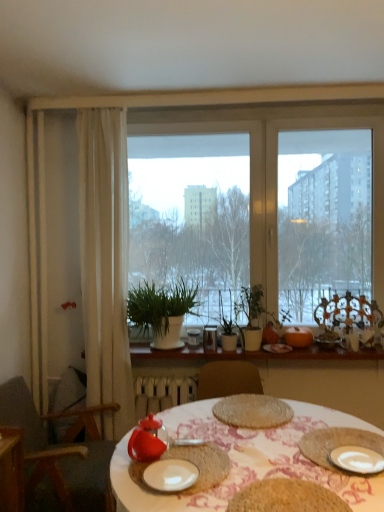
In order to click on free spot behind transparent glass teapot at lower left, the fourth tableware viewed from the back in this screenshot , I will do `click(172, 434)`.